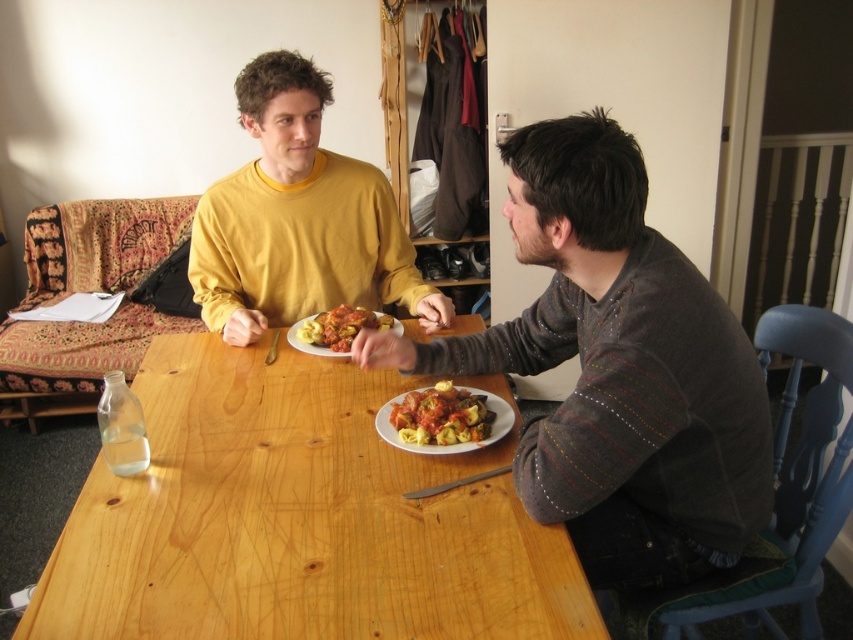
Question: Which of the following is the closest to the observer?

Choices:
 (A) matte yellow sweater at center
 (B) matte tomato sauce pasta at center

Answer: (A)

Question: Which point is farther to the camera?

Choices:
 (A) (389, 209)
 (B) (752, 531)
 (C) (312, 336)
 (D) (433, 392)

Answer: (A)

Question: Does wooden table at center appear on the left side of matte yellow sweater at center?

Choices:
 (A) yes
 (B) no

Answer: (B)

Question: Considering the relative positions of wooden table at center and textured gray sweater at right in the image provided, where is wooden table at center located with respect to textured gray sweater at right?

Choices:
 (A) above
 (B) below

Answer: (B)

Question: Can you confirm if wooden table at center is bigger than matte tomato sauce pasta at center?

Choices:
 (A) no
 (B) yes

Answer: (B)

Question: Which object appears farthest from the camera in this image?

Choices:
 (A) matte tortellini at center
 (B) matte yellow sweater at center
 (C) wooden table at center
 (D) textured gray sweater at right

Answer: (B)